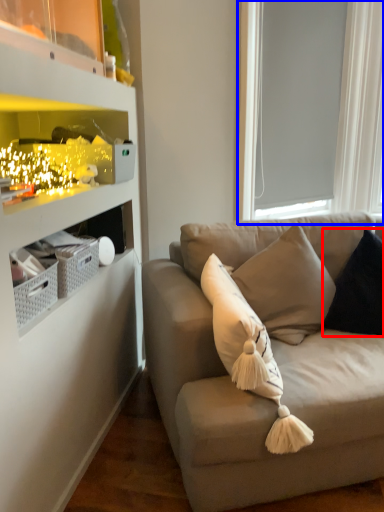
Question: Which point is closer to the camera, pillow (highlighted by a red box) or window screen (highlighted by a blue box)?

Choices:
 (A) pillow
 (B) window screen

Answer: (A)